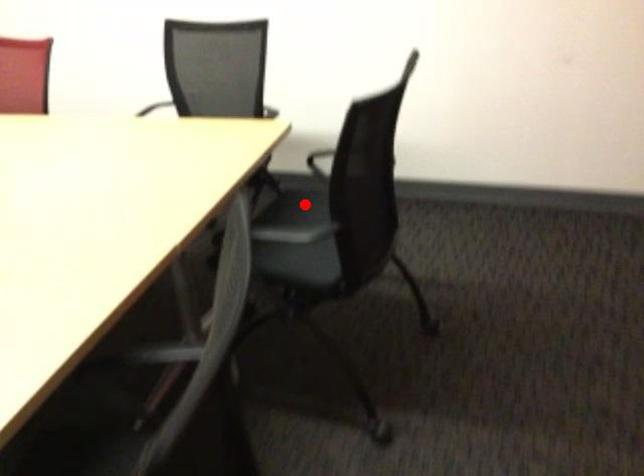
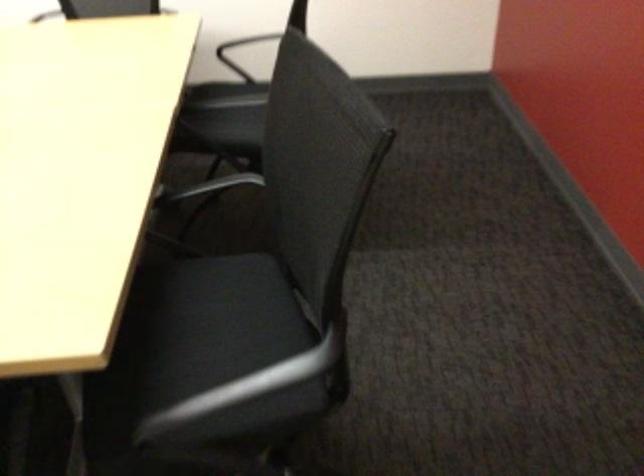
Find the pixel in the second image that matches the highlighted location in the first image.

(223, 93)